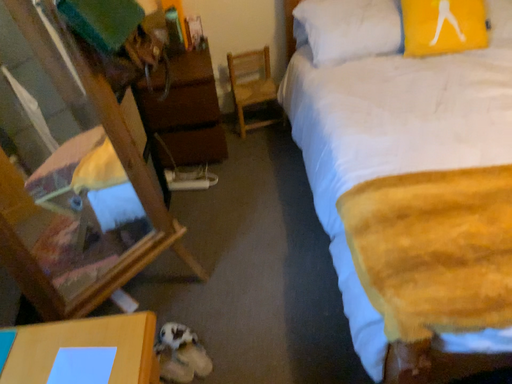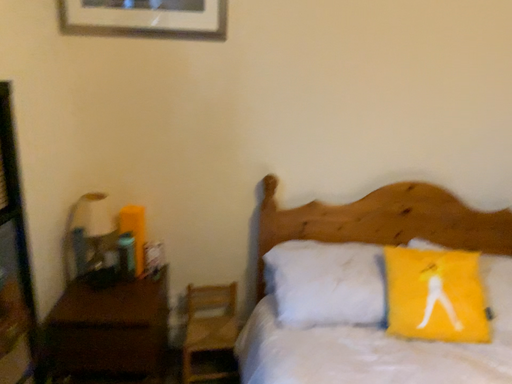
Question: How did the camera likely rotate when shooting the video?

Choices:
 (A) rotated upward
 (B) rotated downward

Answer: (A)